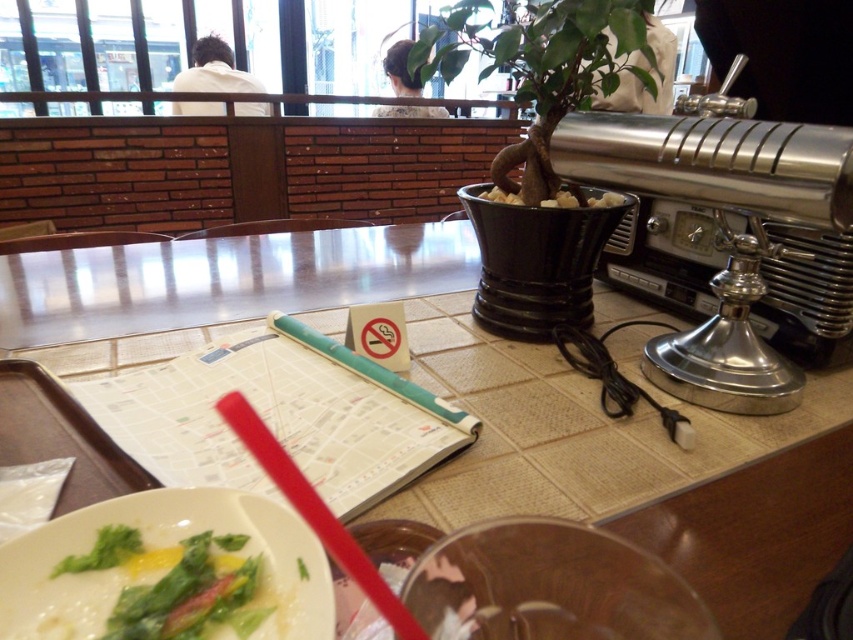
Does green leafy vegetable at center have a larger size compared to red plastic straw at lower center?

Incorrect, green leafy vegetable at center is not larger than red plastic straw at lower center.

Between point (213, 625) and point (233, 420), which one is positioned in front?

Point (213, 625)

Where is `green leafy vegetable at center`? This screenshot has height=640, width=853. green leafy vegetable at center is located at coordinates (175, 584).

Can you confirm if white paper map at center is taller than red plastic straw at lower center?

Indeed, white paper map at center has a greater height compared to red plastic straw at lower center.

Is point (189, 317) positioned after point (314, 518)?

Yes, point (189, 317) is behind point (314, 518).

Find the location of a particular element. white paper map at center is located at coordinates (492, 403).

I want to click on white paper map at center, so click(492, 403).

The image size is (853, 640). What do you see at coordinates (492, 403) in the screenshot?
I see `white paper map at center` at bounding box center [492, 403].

Find the location of a particular element. Image resolution: width=853 pixels, height=640 pixels. white paper map at center is located at coordinates (492, 403).

In order to click on white paper map at center in this screenshot , I will do `click(492, 403)`.